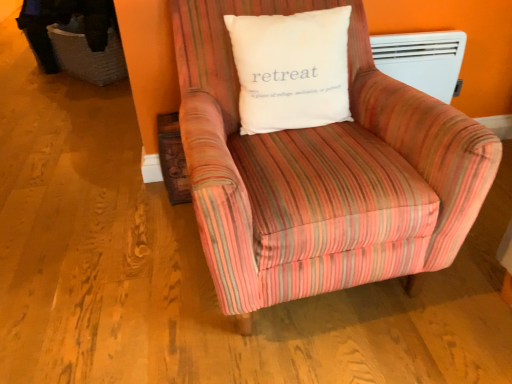
Question: Is striped fabric armchair at center bigger or smaller than white plastic heater at upper right?

Choices:
 (A) small
 (B) big

Answer: (B)

Question: In terms of height, does striped fabric armchair at center look taller or shorter compared to white plastic heater at upper right?

Choices:
 (A) short
 (B) tall

Answer: (B)

Question: Considering the real-world distances, which object is closest to the white cotton pillow at center?

Choices:
 (A) white plastic heater at upper right
 (B) striped fabric armchair at center

Answer: (B)

Question: Which object is positioned closest to the white plastic heater at upper right?

Choices:
 (A) white cotton pillow at center
 (B) striped fabric armchair at center

Answer: (A)